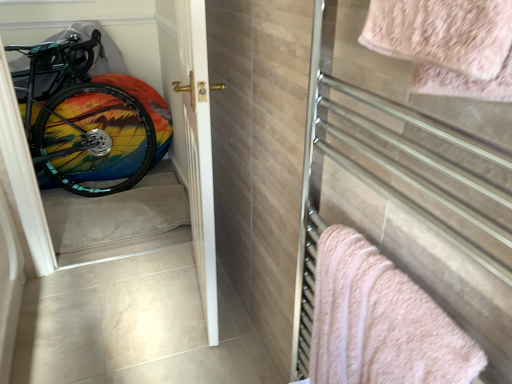
Question: Considering the positions of point (179, 203) and point (200, 114), is point (179, 203) closer or farther from the camera than point (200, 114)?

Choices:
 (A) closer
 (B) farther

Answer: (B)

Question: Is carpeted stairwell at left in front of or behind white glossy door at center in the image?

Choices:
 (A) behind
 (B) front

Answer: (A)

Question: Estimate the real-world distances between objects in this image. Which object is closer to the rainbow painted bicycle wheel at left?

Choices:
 (A) carpeted stairwell at left
 (B) pink fluffy towel at right, acting as the 1th towel starting from the back
 (C) metallic towel rack at right
 (D) pink fluffy towel at upper right, acting as the 1th towel starting from the front
 (E) white glossy door at center

Answer: (A)

Question: Which object is positioned farthest from the metallic towel rack at right?

Choices:
 (A) white glossy door at center
 (B) pink fluffy towel at right, which is the 2th towel in front-to-back order
 (C) pink fluffy towel at upper right, the second towel in the bottom-to-top sequence
 (D) rainbow painted bicycle wheel at left
 (E) carpeted stairwell at left

Answer: (D)